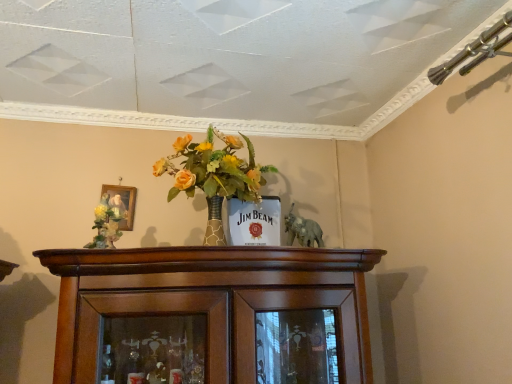
Question: Is matte floral arrangement at left next to gray matte elephant at center?

Choices:
 (A) yes
 (B) no

Answer: (B)

Question: Does matte floral arrangement at left have a greater height compared to gray matte elephant at center?

Choices:
 (A) yes
 (B) no

Answer: (A)

Question: Does matte floral arrangement at left come in front of gray matte elephant at center?

Choices:
 (A) yes
 (B) no

Answer: (A)

Question: From the image's perspective, does matte floral arrangement at left appear higher than gray matte elephant at center?

Choices:
 (A) no
 (B) yes

Answer: (B)

Question: Is matte floral arrangement at left surrounding gray matte elephant at center?

Choices:
 (A) no
 (B) yes

Answer: (A)

Question: In the image, is gold-framed painting at upper left positioned in front of or behind gray matte elephant at center?

Choices:
 (A) behind
 (B) front

Answer: (A)

Question: Is gold-framed painting at upper left to the left or to the right of gray matte elephant at center in the image?

Choices:
 (A) left
 (B) right

Answer: (A)

Question: Based on their sizes in the image, would you say gold-framed painting at upper left is bigger or smaller than gray matte elephant at center?

Choices:
 (A) big
 (B) small

Answer: (B)

Question: Which is correct: gold-framed painting at upper left is inside gray matte elephant at center, or outside of it?

Choices:
 (A) inside
 (B) outside

Answer: (B)

Question: Which is correct: gray matte elephant at center is inside matte floral arrangement at left, or outside of it?

Choices:
 (A) inside
 (B) outside

Answer: (B)

Question: From the image's perspective, is gray matte elephant at center positioned above or below matte floral arrangement at left?

Choices:
 (A) below
 (B) above

Answer: (A)

Question: Looking at their shapes, would you say gray matte elephant at center is wider or thinner than matte floral arrangement at left?

Choices:
 (A) wide
 (B) thin

Answer: (B)

Question: Is gray matte elephant at center bigger or smaller than matte floral arrangement at left?

Choices:
 (A) big
 (B) small

Answer: (A)

Question: From a real-world perspective, is gold-framed painting at upper left above or below matte floral arrangement at left?

Choices:
 (A) above
 (B) below

Answer: (A)

Question: Is gold-framed painting at upper left in front of or behind matte floral arrangement at left in the image?

Choices:
 (A) front
 (B) behind

Answer: (B)